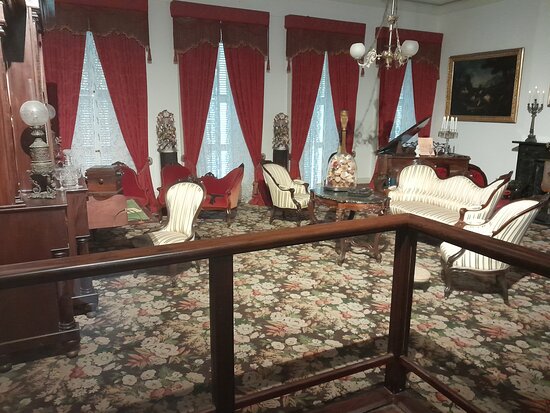
Locate an element on the screen. The image size is (550, 413). chairs is located at coordinates (513, 224), (288, 197), (162, 217).